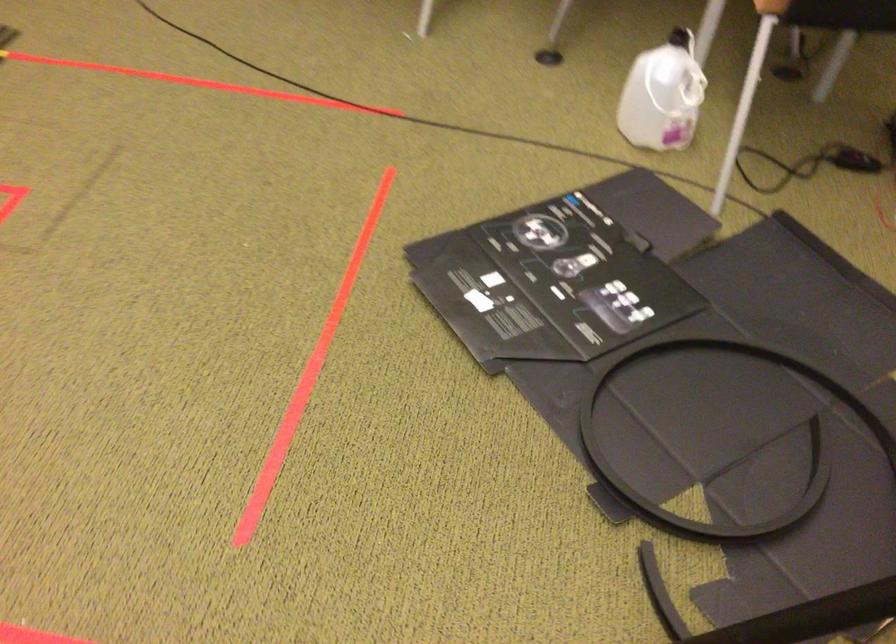
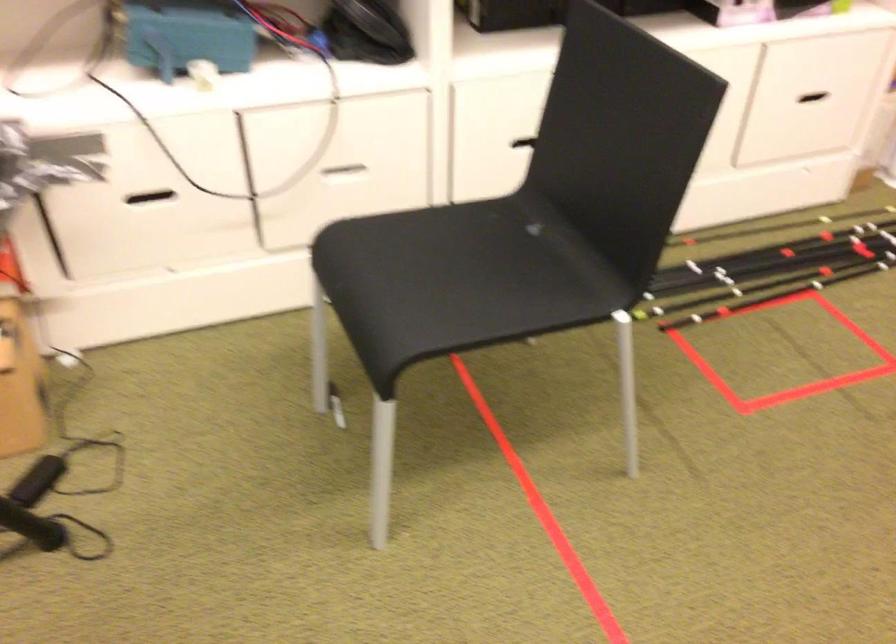
Question: Based on the continuous images, in which direction is the camera rotating? Reply with the corresponding letter.

Choices:
 (A) Left
 (B) Right
 (C) Up
 (D) Down

Answer: (A)